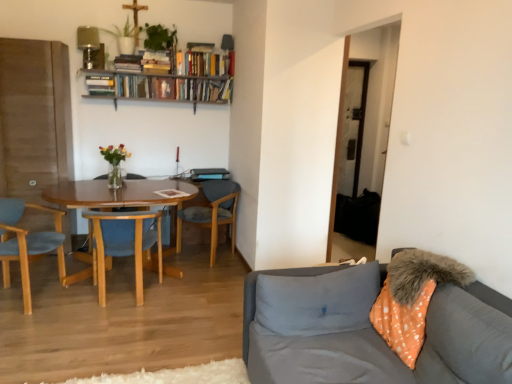
The width and height of the screenshot is (512, 384). Describe the element at coordinates (165, 83) in the screenshot. I see `wooden bookshelf at upper center` at that location.

You are a GUI agent. You are given a task and a screenshot of the screen. Output one action in this format:
    pyautogui.click(x=<x>, y=<y>)
    Task: Click on the light blue fabric chair at left, which appears as the first chair when viewed from the left
    This screenshot has height=384, width=512.
    Given the screenshot: What is the action you would take?
    pyautogui.click(x=27, y=243)

Locate an element on the screen. The image size is (512, 384). wooden bookshelf at upper center is located at coordinates (165, 83).

Is gray fabric couch at lower right wider or thinner than wooden chair at center, positioned as the 1th chair in right-to-left order?

Clearly, gray fabric couch at lower right has more width compared to wooden chair at center, positioned as the 1th chair in right-to-left order.

Consider the image. Which is closer, (x=434, y=368) or (x=212, y=263)?

The point (x=434, y=368) is in front.

Can you confirm if gray fabric couch at lower right is shorter than wooden chair at center, placed as the third chair when sorted from left to right?

Incorrect, the height of gray fabric couch at lower right does not fall short of that of wooden chair at center, placed as the third chair when sorted from left to right.

In the image, there is a wooden bookshelf at upper center. What are the coordinates of `pillow below it (from the image's perspective)` in the screenshot? It's located at (317, 301).

From the image's perspective, would you say gray fabric pillow at lower right is shown under wooden bookshelf at upper center?

Yes, from the image's perspective, gray fabric pillow at lower right is below wooden bookshelf at upper center.

In the scene shown: Which is behind, gray fabric pillow at lower right or wooden bookshelf at upper center?

wooden bookshelf at upper center is further from the camera.

How many degrees apart are the facing directions of woodenchair at left, which appears as the 2th chair when viewed from the left, and gray fabric pillow at lower right?

There is a 170-degree angle between the facing directions of woodenchair at left, which appears as the 2th chair when viewed from the left, and gray fabric pillow at lower right.

From the image's perspective, who appears lower, woodenchair at left, which ranks as the second chair in right-to-left order, or gray fabric pillow at lower right?

From the image's view, gray fabric pillow at lower right is below.

From a real-world perspective, between woodenchair at left, which ranks as the second chair in right-to-left order, and gray fabric pillow at lower right, who is vertically higher?

gray fabric pillow at lower right is physically above.

Do you think light blue fabric chair at left, positioned as the 3th chair in right-to-left order, is within wooden bookshelf at upper center, or outside of it?

light blue fabric chair at left, positioned as the 3th chair in right-to-left order, is not inside wooden bookshelf at upper center, it's outside.

Considering the sizes of objects light blue fabric chair at left, which appears as the first chair when viewed from the left, and wooden bookshelf at upper center in the image provided, who is thinner, light blue fabric chair at left, which appears as the first chair when viewed from the left, or wooden bookshelf at upper center?

wooden bookshelf at upper center.

What's the angular difference between gray fabric couch at lower right and gray fabric pillow at lower right's facing directions?

The angle between the facing direction of gray fabric couch at lower right and the facing direction of gray fabric pillow at lower right is 91 degrees.

Is gray fabric couch at lower right oriented away from gray fabric pillow at lower right?

No, gray fabric couch at lower right is not facing the opposite direction of gray fabric pillow at lower right.

Which is correct: gray fabric couch at lower right is inside gray fabric pillow at lower right, or outside of it?

gray fabric couch at lower right exists outside the volume of gray fabric pillow at lower right.

Is gray fabric couch at lower right bigger than woodenchair at left, which appears as the 2th chair when viewed from the left?

Yes, gray fabric couch at lower right is bigger than woodenchair at left, which appears as the 2th chair when viewed from the left.

Can you confirm if gray fabric couch at lower right is wider than woodenchair at left, which ranks as the second chair in right-to-left order?

Correct, the width of gray fabric couch at lower right exceeds that of woodenchair at left, which ranks as the second chair in right-to-left order.

I want to click on studio couch in front of the woodenchair at left, which appears as the 2th chair when viewed from the left, so click(x=387, y=345).

How many degrees apart are the facing directions of light blue fabric chair at left, positioned as the 3th chair in right-to-left order, and gray fabric pillow at lower right?

71.3 degrees separate the facing orientations of light blue fabric chair at left, positioned as the 3th chair in right-to-left order, and gray fabric pillow at lower right.

Is light blue fabric chair at left, positioned as the 3th chair in right-to-left order, in front of or behind gray fabric pillow at lower right in the image?

Visually, light blue fabric chair at left, positioned as the 3th chair in right-to-left order, is located behind gray fabric pillow at lower right.

Does point (3, 234) come in front of point (324, 315)?

No, it is behind (324, 315).

At what (x,y) coordinates should I click in order to perform the action: click on the 2nd chair above the gray fabric pillow at lower right (from the image's perspective). Please return your answer as a coordinate pair (x, y). Looking at the image, I should click on (27, 243).

Where is `the 3rd chair behind the gray fabric couch at lower right`? The image size is (512, 384). the 3rd chair behind the gray fabric couch at lower right is located at coordinates (212, 212).

Identify the location of pillow below the wooden bookshelf at upper center (from the image's perspective). (317, 301).

Looking at the image, which one is located further to woodenchair at left, which ranks as the second chair in right-to-left order, wooden chair at center, positioned as the 1th chair in right-to-left order, or wooden bookshelf at upper center?

wooden bookshelf at upper center.

Which object lies nearer to the anchor point light blue fabric chair at left, positioned as the 3th chair in right-to-left order, gray fabric pillow at lower right or woodenchair at left, which appears as the 2th chair when viewed from the left?

The object closer to light blue fabric chair at left, positioned as the 3th chair in right-to-left order, is woodenchair at left, which appears as the 2th chair when viewed from the left.

When comparing their distances from wooden bookshelf at upper center, does light blue fabric chair at left, positioned as the 3th chair in right-to-left order, or gray fabric couch at lower right seem further?

Based on the image, gray fabric couch at lower right appears to be further to wooden bookshelf at upper center.

Considering their positions, is gray fabric couch at lower right positioned closer to light blue fabric chair at left, positioned as the 3th chair in right-to-left order, than gray fabric pillow at lower right?

gray fabric pillow at lower right is closer to light blue fabric chair at left, positioned as the 3th chair in right-to-left order.

Based on their spatial positions, is wooden chair at center, placed as the third chair when sorted from left to right, or gray fabric couch at lower right closer to wooden bookshelf at upper center?

wooden chair at center, placed as the third chair when sorted from left to right, is closer to wooden bookshelf at upper center.

When comparing their distances from wooden bookshelf at upper center, does gray fabric pillow at lower right or gray fabric couch at lower right seem further?

gray fabric couch at lower right.

Which object lies nearer to the anchor point gray fabric pillow at lower right, wooden chair at center, positioned as the 1th chair in right-to-left order, or light blue fabric chair at left, which appears as the first chair when viewed from the left?

wooden chair at center, positioned as the 1th chair in right-to-left order.

Looking at the image, which one is located further to gray fabric pillow at lower right, wooden bookshelf at upper center or gray fabric couch at lower right?

wooden bookshelf at upper center.

Locate an element on the screen. The image size is (512, 384). chair between wooden bookshelf at upper center and light blue fabric chair at left, positioned as the 3th chair in right-to-left order, from top to bottom is located at coordinates (212, 212).

You are a GUI agent. You are given a task and a screenshot of the screen. Output one action in this format:
    pyautogui.click(x=<x>, y=<y>)
    Task: Click on the pillow between gray fabric couch at lower right and woodenchair at left, which appears as the 2th chair when viewed from the left, from front to back
    The width and height of the screenshot is (512, 384).
    Given the screenshot: What is the action you would take?
    pyautogui.click(x=317, y=301)

The height and width of the screenshot is (384, 512). In order to click on pillow between gray fabric couch at lower right and wooden chair at center, positioned as the 1th chair in right-to-left order, from front to back in this screenshot , I will do `click(317, 301)`.

This screenshot has width=512, height=384. Identify the location of pillow between light blue fabric chair at left, positioned as the 3th chair in right-to-left order, and gray fabric couch at lower right from left to right. (317, 301).